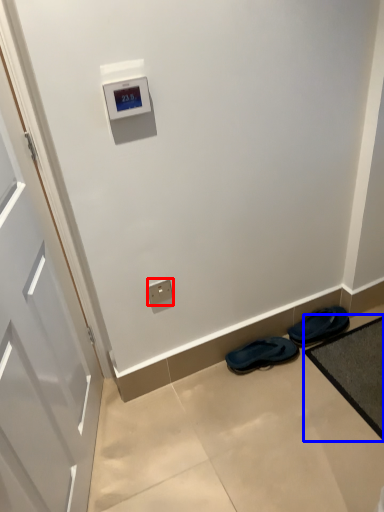
Question: Which of the following is the closest to the observer, electric outlet (highlighted by a red box) or bath mat (highlighted by a blue box)?

Choices:
 (A) electric outlet
 (B) bath mat

Answer: (B)